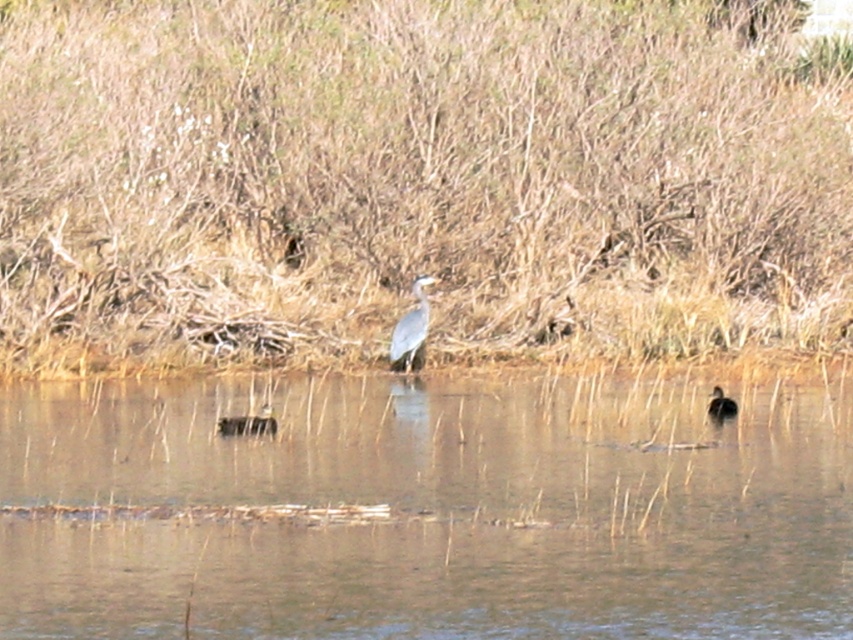
Question: Can you confirm if brown dry grass at center is positioned to the left of gray matte bird at center?

Choices:
 (A) no
 (B) yes

Answer: (B)

Question: Which point is closer to the camera taking this photo?

Choices:
 (A) (350, 515)
 (B) (28, 332)
 (C) (416, 358)

Answer: (A)

Question: Is the position of gray matte bird at center less distant than that of brown speckled duck at right?

Choices:
 (A) yes
 (B) no

Answer: (B)

Question: Can you confirm if brown dry grass at center is positioned below brown speckled duck at right?

Choices:
 (A) yes
 (B) no

Answer: (B)

Question: Among these objects, which one is farthest from the camera?

Choices:
 (A) brown dry grass at center
 (B) brown matte water at center
 (C) brown speckled duck at right

Answer: (A)

Question: Which of the following is the farthest from the observer?

Choices:
 (A) (421, 364)
 (B) (715, 394)
 (C) (172, 465)

Answer: (A)